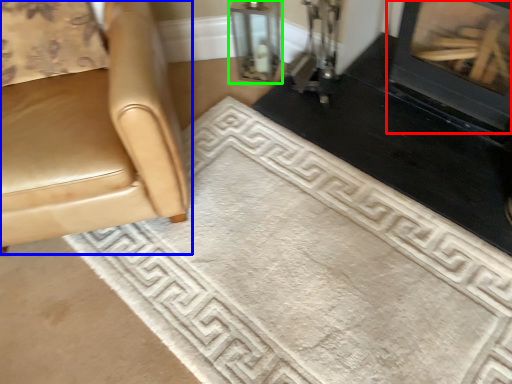
Question: Estimate the real-world distances between objects in this image. Which object is closer to fireplace (highlighted by a red box), chair (highlighted by a blue box) or glass door (highlighted by a green box)?

Choices:
 (A) chair
 (B) glass door

Answer: (B)